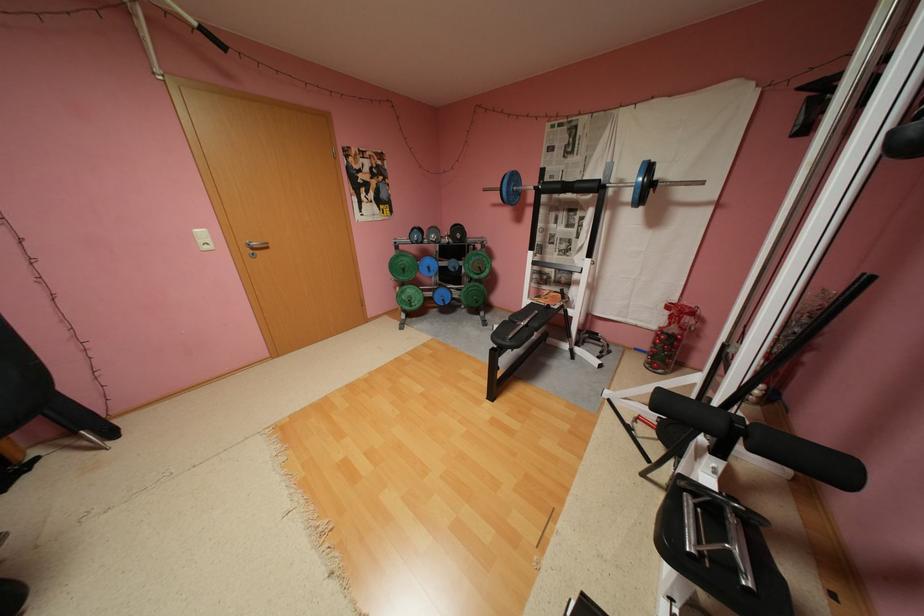
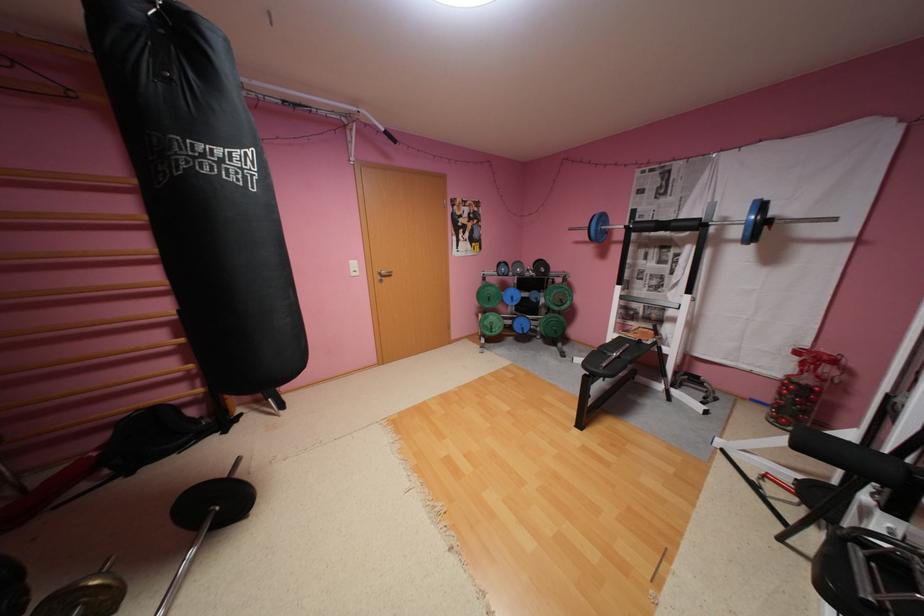
Which direction would the cameraman need to move to produce the second image?

The cameraman walked toward left, backward.